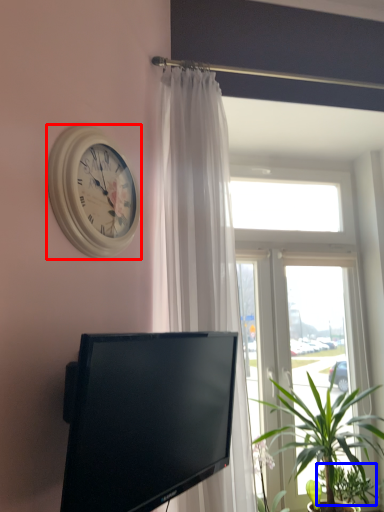
Question: Among these objects, which one is nearest to the camera, wall clock (highlighted by a red box) or plant (highlighted by a blue box)?

Choices:
 (A) wall clock
 (B) plant

Answer: (A)